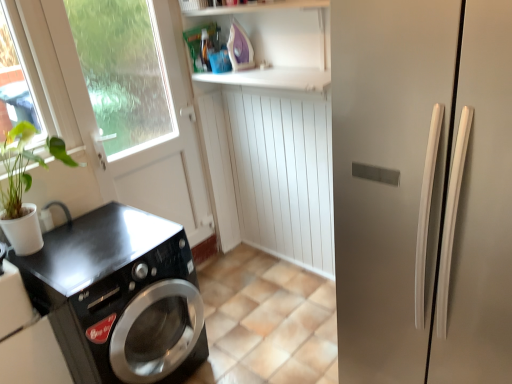
Question: Is purple plastic iron at upper center to the right of black glossy washing machine at lower left from the viewer's perspective?

Choices:
 (A) no
 (B) yes

Answer: (B)

Question: Is purple plastic iron at upper center at the left side of black glossy washing machine at lower left?

Choices:
 (A) no
 (B) yes

Answer: (A)

Question: From the image's perspective, is purple plastic iron at upper center below black glossy washing machine at lower left?

Choices:
 (A) yes
 (B) no

Answer: (B)

Question: Could you tell me if purple plastic iron at upper center is turned towards black glossy washing machine at lower left?

Choices:
 (A) no
 (B) yes

Answer: (A)

Question: Is purple plastic iron at upper center thinner than black glossy washing machine at lower left?

Choices:
 (A) no
 (B) yes

Answer: (B)

Question: Is black glossy washing machine at lower left to the left or to the right of purple plastic iron at upper center in the image?

Choices:
 (A) right
 (B) left

Answer: (B)

Question: From a real-world perspective, is black glossy washing machine at lower left above or below purple plastic iron at upper center?

Choices:
 (A) above
 (B) below

Answer: (B)

Question: In the image, is black glossy washing machine at lower left positioned in front of or behind purple plastic iron at upper center?

Choices:
 (A) front
 (B) behind

Answer: (A)

Question: Is black glossy washing machine at lower left inside the boundaries of purple plastic iron at upper center, or outside?

Choices:
 (A) inside
 (B) outside

Answer: (B)

Question: From the image's perspective, is purple plastic iron at upper center located above or below black glossy washing machine at lower left?

Choices:
 (A) above
 (B) below

Answer: (A)

Question: Is point pos(227,38) positioned closer to the camera than point pos(11,329)?

Choices:
 (A) farther
 (B) closer

Answer: (A)

Question: From their relative heights in the image, would you say purple plastic iron at upper center is taller or shorter than black glossy washing machine at lower left?

Choices:
 (A) short
 (B) tall

Answer: (A)

Question: Is purple plastic iron at upper center situated inside black glossy washing machine at lower left or outside?

Choices:
 (A) inside
 (B) outside

Answer: (B)

Question: From a real-world perspective, is satin silver refrigerator at right positioned above or below black glossy washing machine at lower left?

Choices:
 (A) below
 (B) above

Answer: (B)

Question: In the image, is satin silver refrigerator at right on the left side or the right side of black glossy washing machine at lower left?

Choices:
 (A) left
 (B) right

Answer: (B)